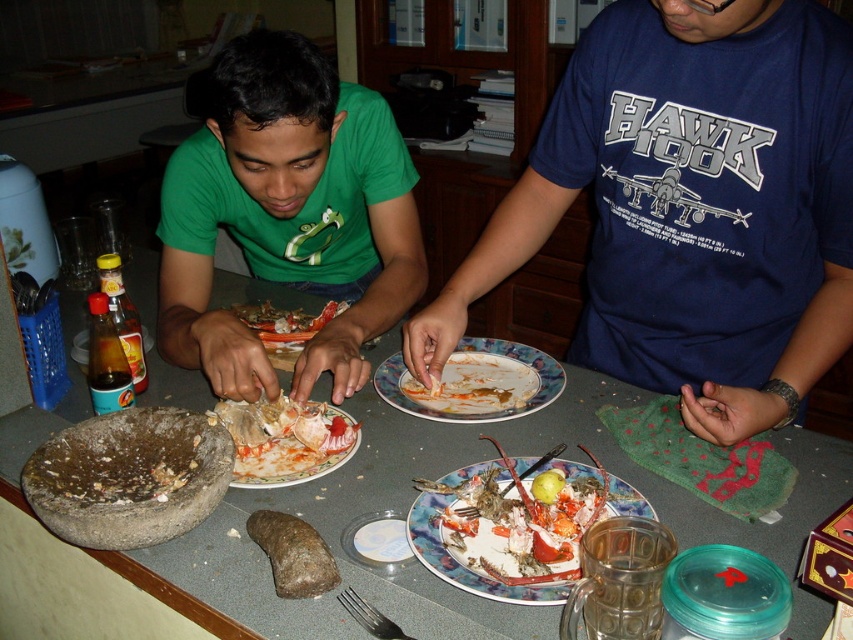
You are a photographer standing at the edge of the table. You want to take a closeup shot of the white matte plate at center without including the smooth gray table at center in the frame. Is it possible given their positions?

The smooth gray table at center is closer to the viewer than the white matte plate at center. Since the table is closer, it would block the view of the plate unless you move the table or adjust your angle. Therefore, it might not be possible to capture the plate without the table in the frame unless you reposition yourself or the objects.

You are a photographer trying to capture a closeup of the mortar and pestle. You notice two points marked on your screen at coordinates point (469,468) and point (297,342). Which point should you focus on to ensure the mortar and pestle is in clear focus?

Point (469,468) is closer to the camera than point (297,342), so focusing on point (469,468) will ensure the mortar and pestle is in clear focus.

You are a food critic who needs to describe the size relationship between the crusty ceramic plate at center and the shiny orange lobster at center in the image. How would you phrase this?

The crusty ceramic plate at center is bigger than the shiny orange lobster at center, so the plate is larger in size compared to the lobster.